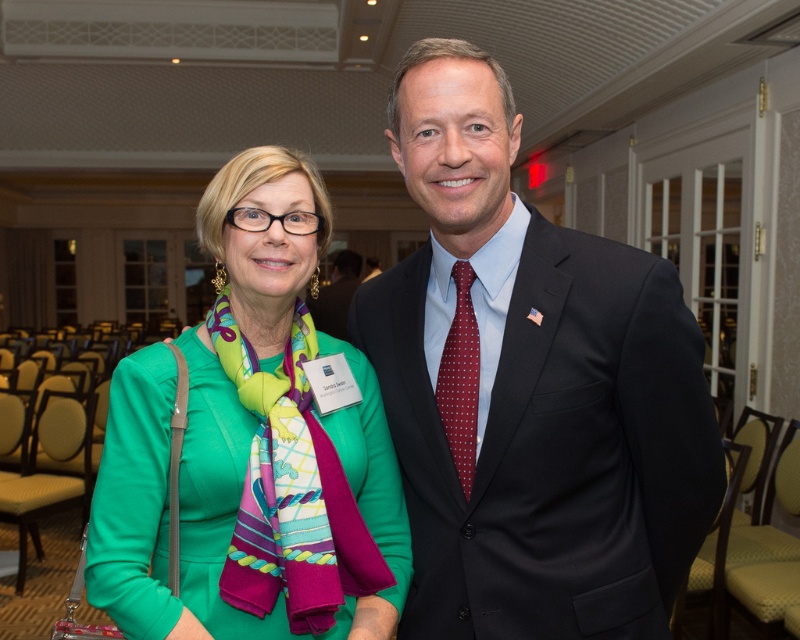
You are at a formal event and see two people in dark suits. One is wearing a dark blue suit at center and the other is in a dark suit at center. According to the image, which one is positioned to the right?

The dark blue suit at center is positioned to the right of the dark suit at center.

You are a photographer at a formal event and need to capture both the dark blue suit at center and the dark suit at center in a single frame. Given that your camera has a focal length of 50mm and the minimum distance between the suits for proper framing is 2 meters, can you position yourself to include both in the frame?

The dark blue suit at center is 4.42 meters from dark suit at center. Since the minimum required distance for proper framing is 2 meters, the photographer can position themselves to include both in the frame as the distance between them is sufficient.

You are a photographer at a formal event. You need to capture a photo of the dark blue suit at center and the green silk scarf at center. Which object is located to the right of the other?

The dark blue suit at center is positioned on the right side of green silk scarf at center.